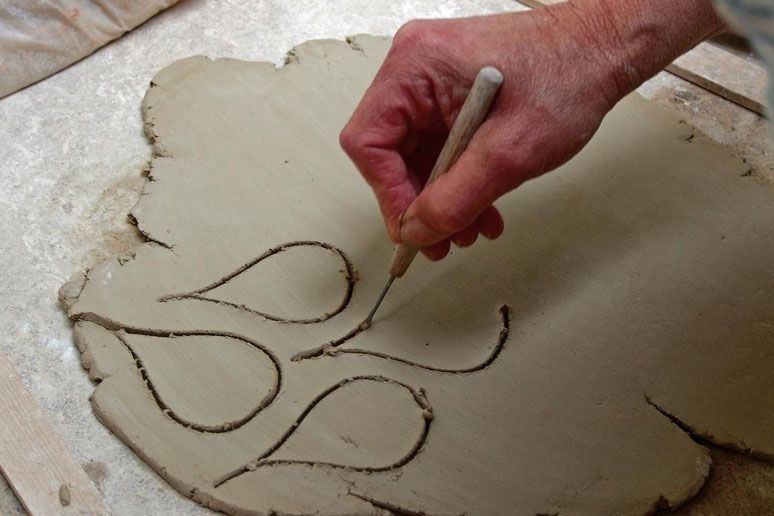
Identify the location of counter. (77, 145).